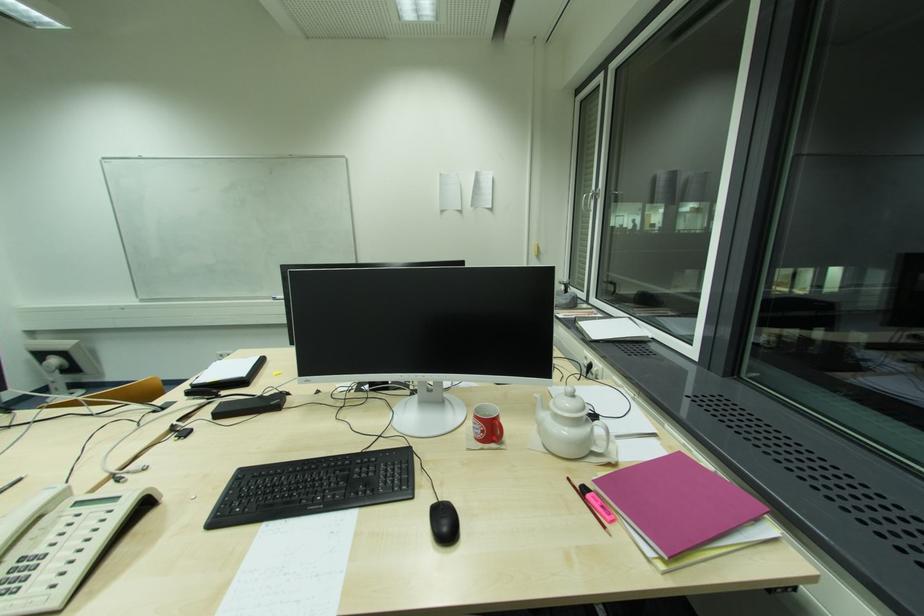
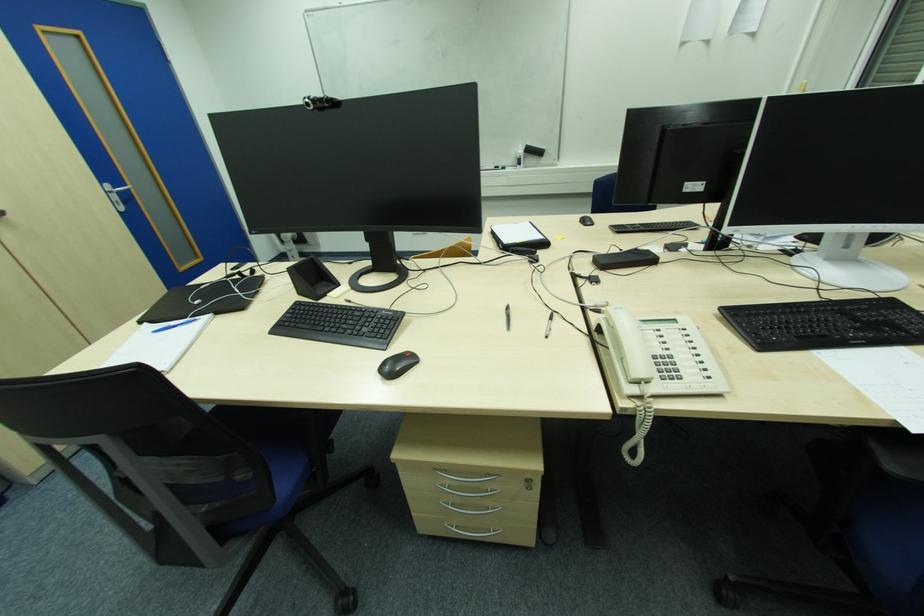
The point at (80, 516) is marked in the first image. Where is the corresponding point in the second image?

(661, 331)